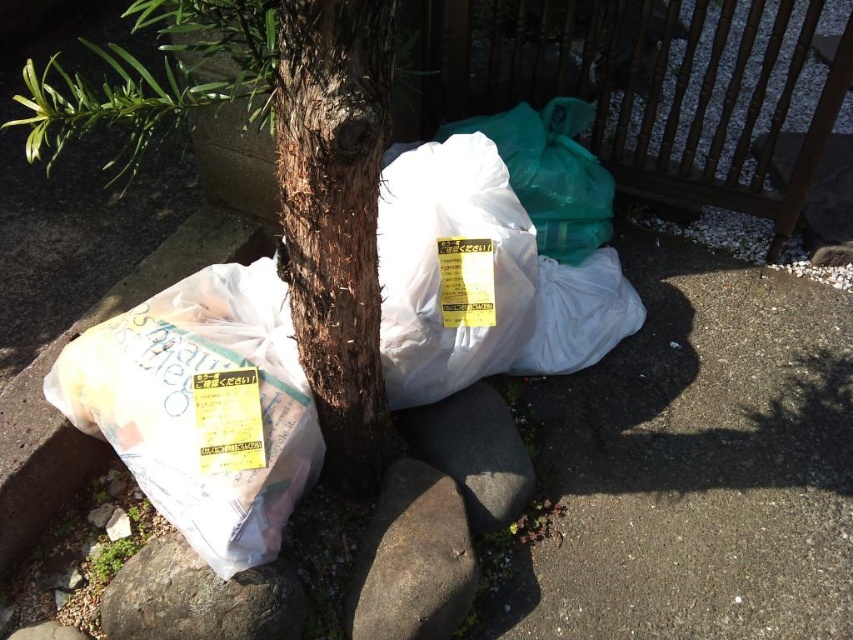
You have a small container that can only hold items up to the size of the brown rough stone at lower center. Can you fit the white plastic bag at lower left into the container without it overflowing?

The white plastic bag at lower left is larger in width than the brown rough stone at lower center, so it won

You are a park maintenance worker who needs to collect all items left near the tree trunk. You see the white plastic bag at left and the gray rough stone at center. Which item is located to the east of the other?

The white plastic bag at left is positioned on the left side of gray rough stone at center, so it is located to the east of the gray rough stone at center.

You are an environmental inspector checking recycling bins. You notice a white plastic bag at lower left and a brown rough bark tree at center. Which object has a greater width?

The white plastic bag at lower left has a greater width than the brown rough bark tree at center according to the description.